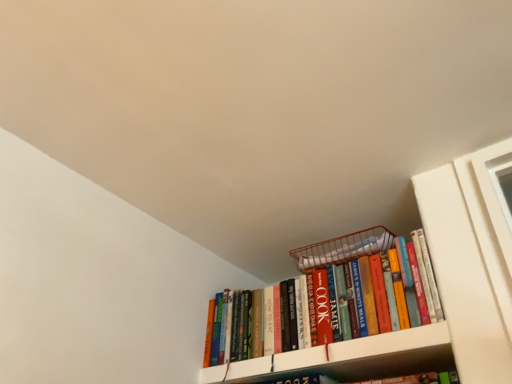
Question: Should I look upward or downward to see white matte bookshelf at upper right?

Choices:
 (A) down
 (B) up

Answer: (A)

Question: Is white matte bookshelf at upper right facing away from hardcover books at upper right?

Choices:
 (A) no
 (B) yes

Answer: (A)

Question: Could you tell me if white matte bookshelf at upper right is facing hardcover books at upper right?

Choices:
 (A) no
 (B) yes

Answer: (A)

Question: Considering the relative positions of white matte bookshelf at upper right and hardcover books at upper right in the image provided, is white matte bookshelf at upper right to the left of hardcover books at upper right from the viewer's perspective?

Choices:
 (A) no
 (B) yes

Answer: (A)

Question: Is white matte bookshelf at upper right not close to hardcover books at upper right?

Choices:
 (A) yes
 (B) no

Answer: (B)

Question: Is white matte bookshelf at upper right shorter than hardcover books at upper right?

Choices:
 (A) yes
 (B) no

Answer: (A)

Question: From a real-world perspective, is white matte bookshelf at upper right positioned over hardcover books at upper right based on gravity?

Choices:
 (A) no
 (B) yes

Answer: (A)

Question: From the image's perspective, does hardcover books at upper right appear higher than white matte bookshelf at upper right?

Choices:
 (A) yes
 (B) no

Answer: (A)

Question: Considering the relative positions of hardcover books at upper right and white matte bookshelf at upper right in the image provided, is hardcover books at upper right to the left of white matte bookshelf at upper right from the viewer's perspective?

Choices:
 (A) yes
 (B) no

Answer: (A)

Question: Considering the relative positions of hardcover books at upper right and white matte bookshelf at upper right in the image provided, is hardcover books at upper right to the right of white matte bookshelf at upper right from the viewer's perspective?

Choices:
 (A) yes
 (B) no

Answer: (B)

Question: Does hardcover books at upper right have a larger size compared to white matte bookshelf at upper right?

Choices:
 (A) yes
 (B) no

Answer: (A)

Question: Is hardcover books at upper right surrounding white matte bookshelf at upper right?

Choices:
 (A) yes
 (B) no

Answer: (B)

Question: Is hardcover books at upper right positioned with its back to white matte bookshelf at upper right?

Choices:
 (A) no
 (B) yes

Answer: (A)

Question: Considering the relative positions of hardcover books at upper right and white matte bookshelf at upper right in the image provided, is hardcover books at upper right to the left or to the right of white matte bookshelf at upper right?

Choices:
 (A) left
 (B) right

Answer: (A)